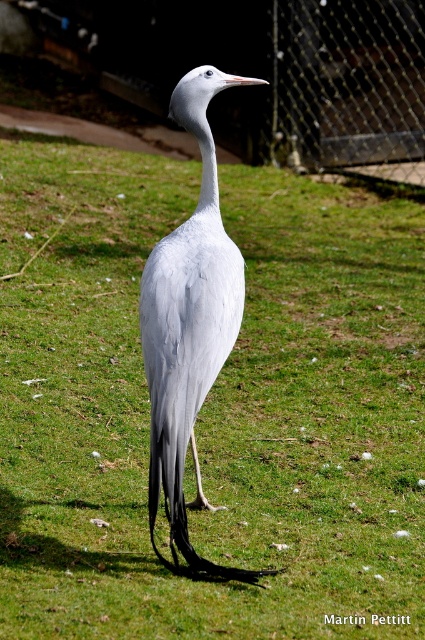
Can you confirm if gray matte bird at center is bigger than metal mesh fence at upper right?

No.

Is point (238, 282) positioned behind point (288, 134)?

No, (238, 282) is closer to viewer.

Is point (159, 461) positioned behind point (282, 106)?

No, (159, 461) is in front of (282, 106).

Locate an element on the screen. This screenshot has height=640, width=425. gray matte bird at center is located at coordinates (189, 326).